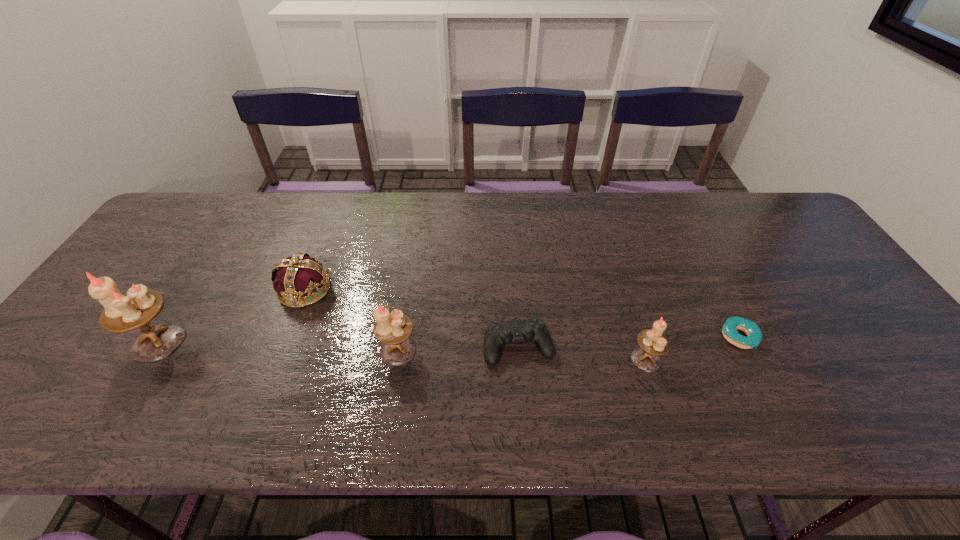
Identify the location of the fourth object from left to right. This screenshot has width=960, height=540. (533, 330).

Find the location of a particular element. the second shortest object is located at coordinates (533, 330).

The height and width of the screenshot is (540, 960). Find the location of `vacant point located 0.140m on the right of the leftmost candle holder`. vacant point located 0.140m on the right of the leftmost candle holder is located at coordinates (242, 342).

Locate an element on the screen. Image resolution: width=960 pixels, height=540 pixels. vacant area located on the left of the second tallest candle holder is located at coordinates (350, 350).

This screenshot has width=960, height=540. Find the location of `vacant region located 0.320m on the back of the rightmost candle holder`. vacant region located 0.320m on the back of the rightmost candle holder is located at coordinates (613, 257).

Where is `free spot located 0.060m on the front of the third shortest object`? free spot located 0.060m on the front of the third shortest object is located at coordinates (290, 329).

I want to click on free location located on the back of the shortest object, so click(x=697, y=255).

The width and height of the screenshot is (960, 540). I want to click on vacant space located 0.370m on the right of the fifth tallest object, so click(x=708, y=347).

I want to click on control at the near edge, so click(533, 330).

The height and width of the screenshot is (540, 960). Find the location of `object at the left edge`. object at the left edge is located at coordinates (139, 306).